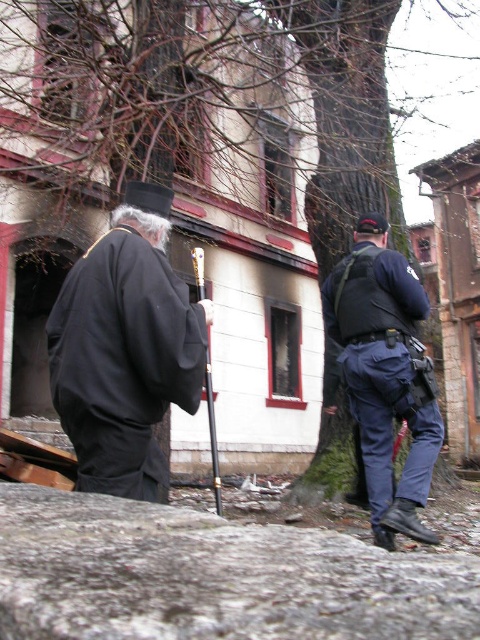
Is black matte robe at left to the left of navy blue uniform at right from the viewer's perspective?

Yes, black matte robe at left is to the left of navy blue uniform at right.

Is black matte robe at left smaller than navy blue uniform at right?

Yes, black matte robe at left is smaller than navy blue uniform at right.

Is point (109, 248) more distant than point (403, 289)?

No, it is in front of (403, 289).

I want to click on black matte robe at left, so click(124, 348).

From the picture: Can you confirm if gray rough stone at lower center is thinner than black matte robe at left?

Incorrect, gray rough stone at lower center's width is not less than black matte robe at left's.

Which is in front, point (98, 570) or point (79, 280)?

Point (98, 570)

The image size is (480, 640). What are the coordinates of `gray rough stone at lower center` in the screenshot? It's located at (214, 577).

Is gray rough stone at lower center thinner than navy blue uniform at right?

No, gray rough stone at lower center is not thinner than navy blue uniform at right.

Consider the image. Can you confirm if gray rough stone at lower center is positioned to the left of navy blue uniform at right?

Indeed, gray rough stone at lower center is positioned on the left side of navy blue uniform at right.

Is point (327, 596) positioned behind point (358, 241)?

No, (327, 596) is in front of (358, 241).

Locate an element on the screen. The image size is (480, 640). gray rough stone at lower center is located at coordinates (214, 577).